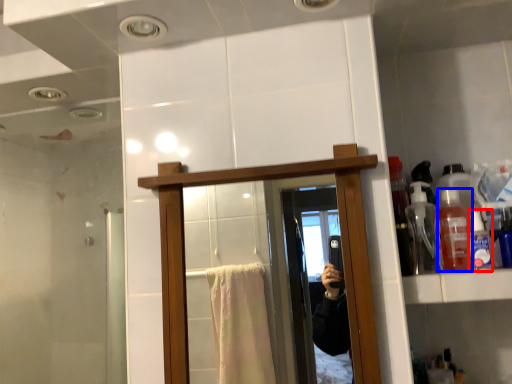
Question: Which of the following is the farthest to the observer, toiletry (highlighted by a red box) or bottle (highlighted by a blue box)?

Choices:
 (A) toiletry
 (B) bottle

Answer: (B)